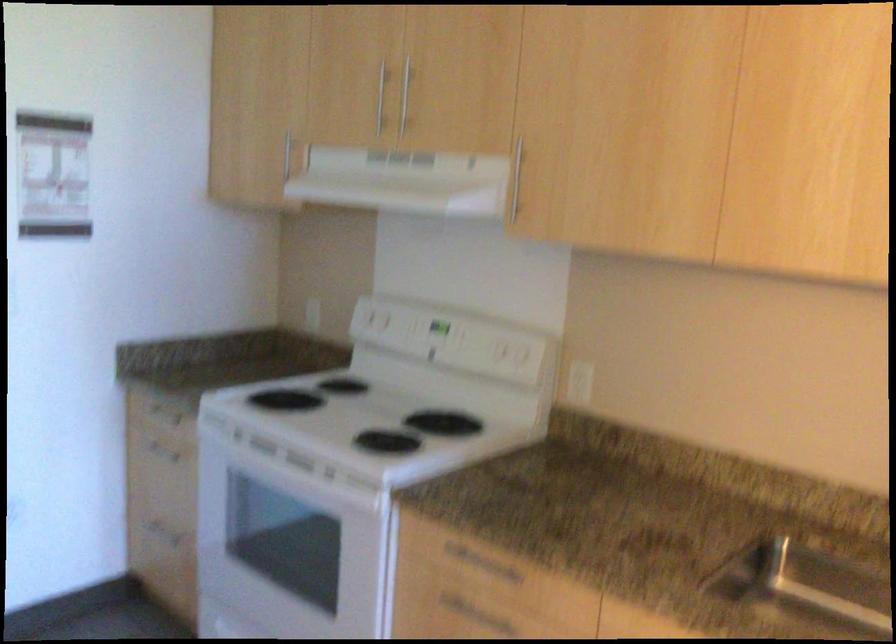
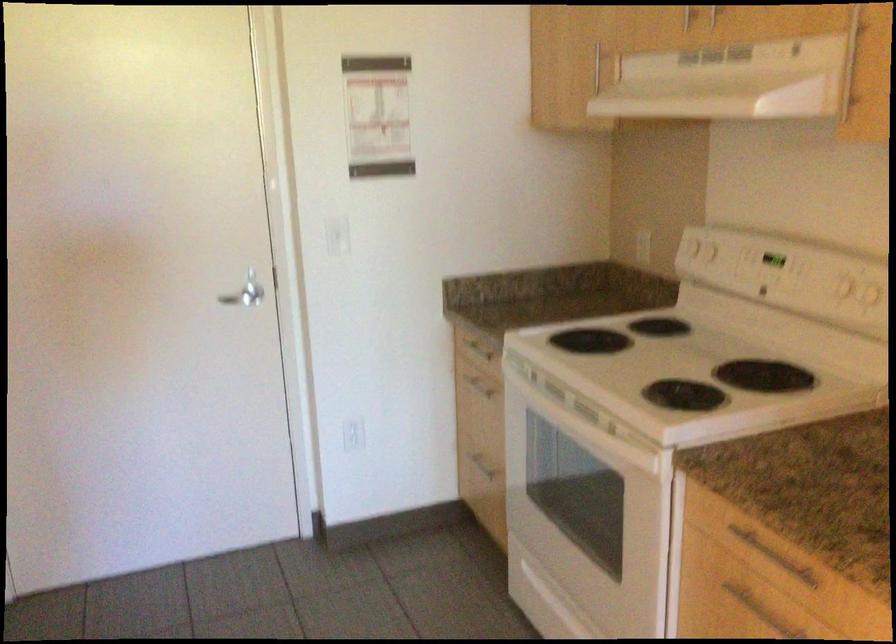
Where in the second image is the point corresponding to pixel 524 182 from the first image?

(868, 77)